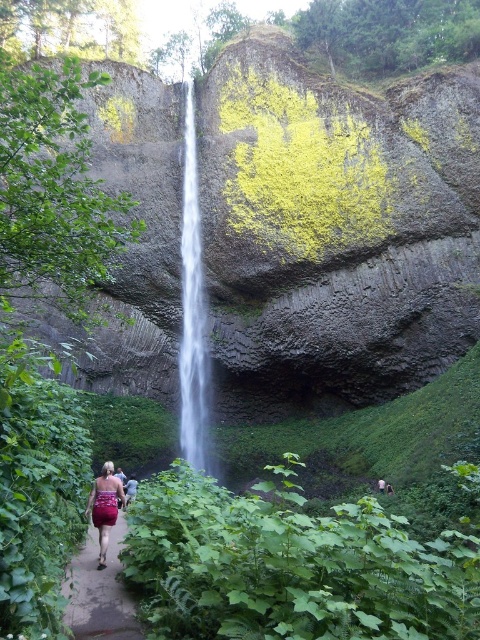
Does clear glass waterfall at center have a lesser height compared to dark brown leather jacket at lower center?

Incorrect, clear glass waterfall at center's height does not fall short of dark brown leather jacket at lower center's.

Is point (206, 360) farther from camera compared to point (388, 484)?

Yes.

Find the location of `clear glass waterfall at center`. clear glass waterfall at center is located at coordinates (192, 308).

Can you confirm if green leafy shrub at upper left is smaller than maroon satin dress at lower center?

No, green leafy shrub at upper left is not smaller than maroon satin dress at lower center.

Looking at this image, who is more forward, (6,208) or (101,512)?

Point (101,512)

Image resolution: width=480 pixels, height=640 pixels. In order to click on green leafy shrub at upper left in this screenshot , I will do `click(54, 193)`.

Does clear glass waterfall at center have a lesser height compared to dark brown leather backpack at lower left?

In fact, clear glass waterfall at center may be taller than dark brown leather backpack at lower left.

You are a GUI agent. You are given a task and a screenshot of the screen. Output one action in this format:
    pyautogui.click(x=<x>, y=<y>)
    Task: Click on the clear glass waterfall at center
    
    Given the screenshot: What is the action you would take?
    pyautogui.click(x=192, y=308)